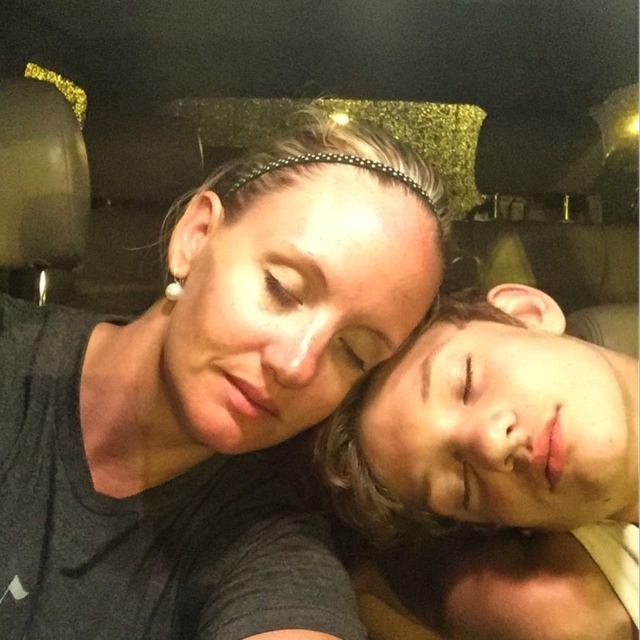
Question: Is matte black hair at center bigger than smooth skin face at right?

Choices:
 (A) yes
 (B) no

Answer: (B)

Question: Is matte black hair at center further to the viewer compared to smooth skin face at right?

Choices:
 (A) yes
 (B) no

Answer: (B)

Question: Is matte black hair at center wider than smooth skin face at right?

Choices:
 (A) yes
 (B) no

Answer: (A)

Question: Among these points, which one is nearest to the camera?

Choices:
 (A) (179, 621)
 (B) (396, 408)

Answer: (B)